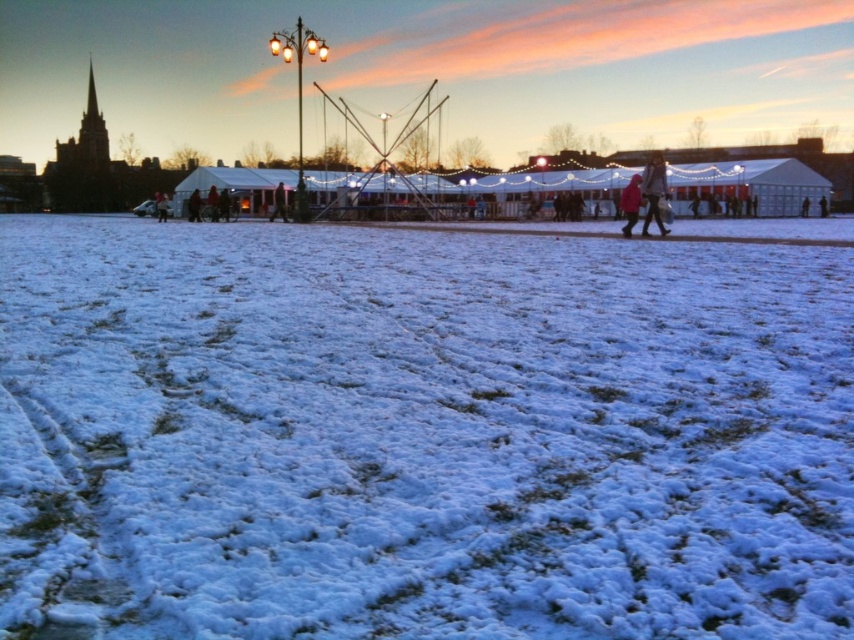
Question: Does white fluffy snow at center appear under matte pink coat at center?

Choices:
 (A) yes
 (B) no

Answer: (A)

Question: In this image, where is matte pink coat at right located relative to matte pink coat at center?

Choices:
 (A) left
 (B) right

Answer: (B)

Question: Which point is farther from the camera taking this photo?

Choices:
 (A) (630, 186)
 (B) (648, 180)
 (C) (51, 308)

Answer: (A)

Question: Which of the following is the farthest from the observer?

Choices:
 (A) white fluffy snow at center
 (B) matte pink coat at center
 (C) matte pink coat at right

Answer: (B)

Question: Which point is closer to the camera taking this photo?

Choices:
 (A) (630, 220)
 (B) (496, 259)

Answer: (B)

Question: Is matte pink coat at right positioned behind matte pink coat at center?

Choices:
 (A) no
 (B) yes

Answer: (A)